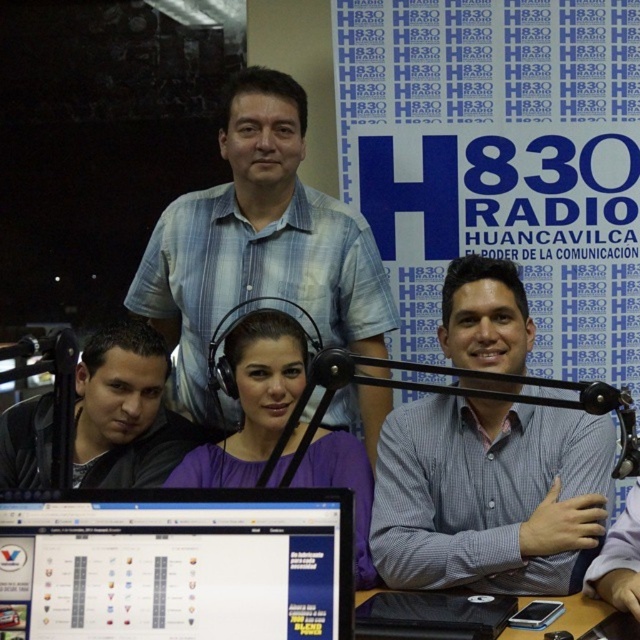
Question: Can you confirm if matte black monitor at lower left is positioned to the right of metallic black microphone at right?

Choices:
 (A) yes
 (B) no

Answer: (B)

Question: Which of the following is the farthest from the observer?

Choices:
 (A) blue plaid shirt at center
 (B) metallic black microphone at right
 (C) white checkered shirt at center

Answer: (A)

Question: Where is matte black monitor at lower left located in relation to blue plaid shirt at center in the image?

Choices:
 (A) above
 (B) below

Answer: (B)

Question: Does purple matte shirt at center appear over metallic black microphone at right?

Choices:
 (A) no
 (B) yes

Answer: (A)

Question: Based on their relative distances, which object is farther from the matte black monitor at lower left?

Choices:
 (A) purple matte shirt at center
 (B) blue plaid shirt at center
 (C) white checkered shirt at center

Answer: (B)

Question: Which point is closer to the camera?

Choices:
 (A) blue plaid shirt at center
 (B) black plastic table at lower right
 (C) white checkered shirt at center

Answer: (B)